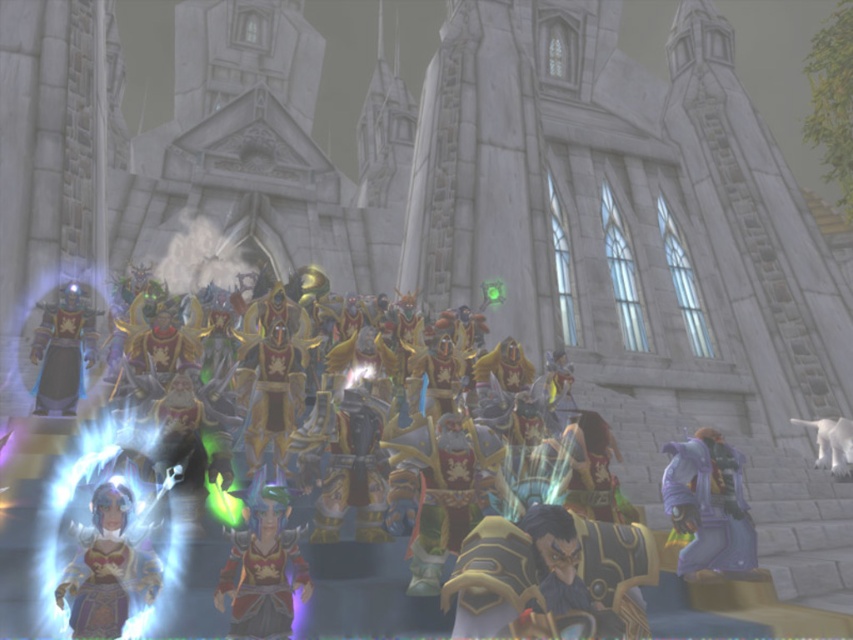
Question: Can you confirm if shiny gold armor at center is positioned to the right of purple matte armor at lower right?

Choices:
 (A) yes
 (B) no

Answer: (B)

Question: Can you confirm if shiny gold armor at center is positioned to the right of translucent purple dress at lower left?

Choices:
 (A) no
 (B) yes

Answer: (A)

Question: Estimate the real-world distances between objects in this image. Which object is closer to the shiny green armor at center?

Choices:
 (A) shiny gold armor at left
 (B) translucent purple dress at lower left
 (C) shiny gold armor at center
 (D) purple matte armor at lower right

Answer: (B)

Question: Among these objects, which one is nearest to the camera?

Choices:
 (A) purple matte armor at lower right
 (B) shiny green armor at center
 (C) translucent purple dress at lower left
 (D) shiny gold armor at center

Answer: (C)

Question: Which point is farther from the camera taking this photo?

Choices:
 (A) (700, 428)
 (B) (71, 332)

Answer: (B)

Question: Does shiny green armor at center have a greater width compared to shiny gold armor at left?

Choices:
 (A) no
 (B) yes

Answer: (A)